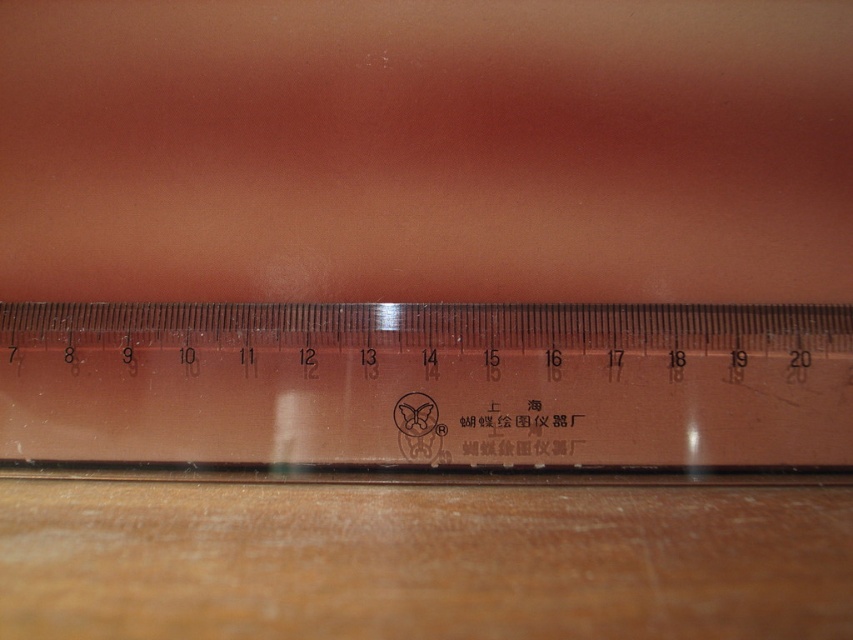
You are arranging items on a desk and need to place the transparent plastic ruler at center and the wooden table at lower center. According to the image, which object is positioned to the right of the other?

The transparent plastic ruler at center is to the right of the wooden table at lower center.

You are trying to determine if the transparent plastic ruler at center can be placed vertically on the wooden table at lower center without touching the table surface. Based on their heights, is this possible?

The transparent plastic ruler at center has a greater height compared to wooden table at lower center. Therefore, placing it vertically would cause it to extend beyond the table, potentially touching the surface below.